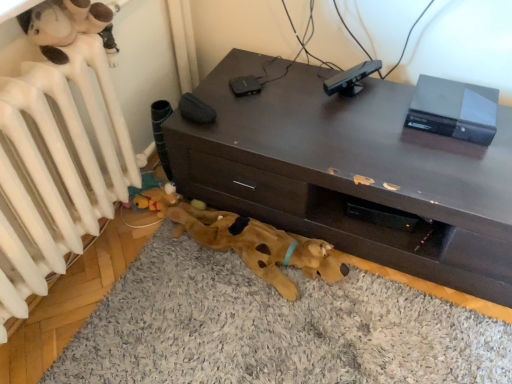
Question: Should I look upward or downward to see white matte radiator at upper left?

Choices:
 (A) up
 (B) down

Answer: (A)

Question: Is brown plush dog bed at lower center outside of black matte sensor at upper center?

Choices:
 (A) no
 (B) yes

Answer: (B)

Question: Can you confirm if brown plush dog bed at lower center is taller than black matte sensor at upper center?

Choices:
 (A) no
 (B) yes

Answer: (A)

Question: Is brown plush dog bed at lower center at the right side of black matte sensor at upper center?

Choices:
 (A) yes
 (B) no

Answer: (B)

Question: Can black matte sensor at upper center be found inside brown plush dog bed at lower center?

Choices:
 (A) yes
 (B) no

Answer: (B)

Question: Is brown plush dog bed at lower center not close to black matte sensor at upper center?

Choices:
 (A) no
 (B) yes

Answer: (A)

Question: Is brown plush dog bed at lower center next to black matte sensor at upper center and touching it?

Choices:
 (A) yes
 (B) no

Answer: (B)

Question: Is black matte sensor at upper center far from dark brown wood desk at center?

Choices:
 (A) no
 (B) yes

Answer: (A)

Question: Is the position of black matte sensor at upper center more distant than that of dark brown wood desk at center?

Choices:
 (A) yes
 (B) no

Answer: (A)

Question: From the image's perspective, is black matte sensor at upper center over dark brown wood desk at center?

Choices:
 (A) no
 (B) yes

Answer: (B)

Question: Can you confirm if black matte sensor at upper center is bigger than dark brown wood desk at center?

Choices:
 (A) yes
 (B) no

Answer: (B)

Question: Does black matte sensor at upper center have a lesser width compared to dark brown wood desk at center?

Choices:
 (A) no
 (B) yes

Answer: (B)

Question: Is black matte sensor at upper center wider than dark brown wood desk at center?

Choices:
 (A) yes
 (B) no

Answer: (B)

Question: From the image's perspective, would you say white matte radiator at upper left is positioned over black matte sensor at upper center?

Choices:
 (A) yes
 (B) no

Answer: (B)